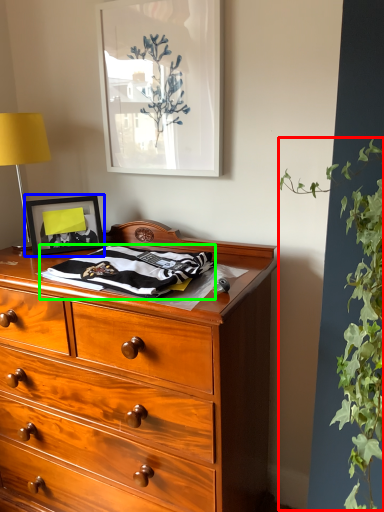
Question: Estimate the real-world distances between objects in this image. Which object is farther from vegetation (highlighted by a red box), picture frame (highlighted by a blue box) or blanket (highlighted by a green box)?

Choices:
 (A) picture frame
 (B) blanket

Answer: (A)